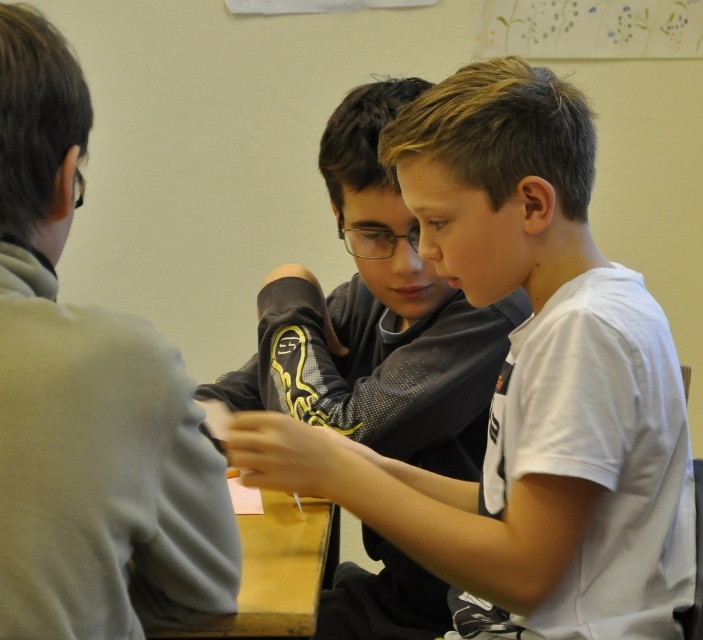
Image resolution: width=703 pixels, height=640 pixels. What do you see at coordinates (524, 381) in the screenshot?
I see `white matte shirt at center` at bounding box center [524, 381].

Is white matte shirt at center further to camera compared to yellow wood table at lower center?

No, white matte shirt at center is closer to the viewer.

Locate an element on the screen. The height and width of the screenshot is (640, 703). white matte shirt at center is located at coordinates (524, 381).

Locate an element on the screen. The width and height of the screenshot is (703, 640). white matte shirt at center is located at coordinates (524, 381).

Consider the image. Does light gray sweater at left have a greater width compared to yellow wood table at lower center?

Yes.

Does point (37, 163) come behind point (257, 625)?

No, (37, 163) is closer to viewer.

This screenshot has width=703, height=640. I want to click on light gray sweater at left, so click(89, 401).

Is white matte shirt at center wider than light gray sweater at left?

Indeed, white matte shirt at center has a greater width compared to light gray sweater at left.

Is point (643, 374) positioned after point (79, 595)?

Yes.

Where is `white matte shirt at center`? white matte shirt at center is located at coordinates coord(524,381).